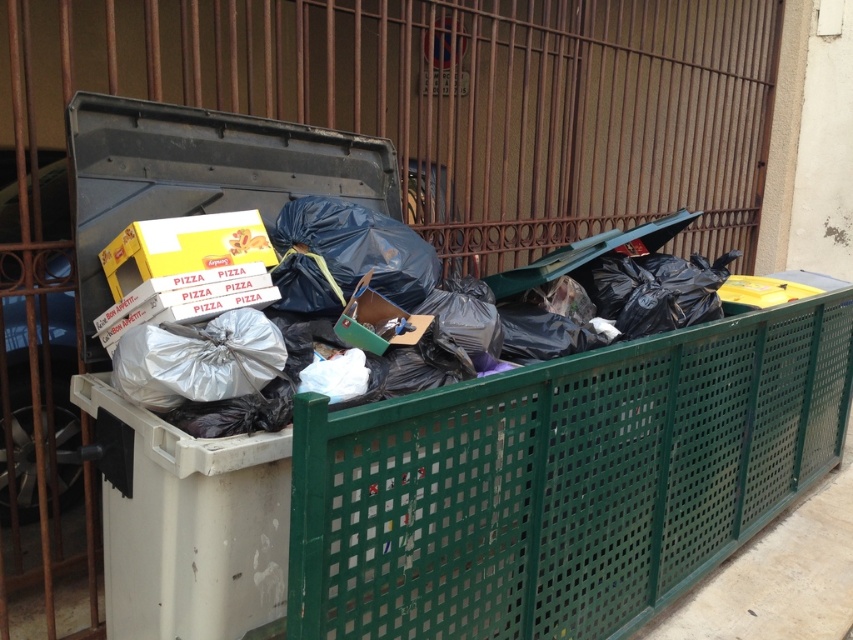
Does point (521, 323) come behind point (163, 237)?

Yes, point (521, 323) is behind point (163, 237).

Which is behind, point (183, 403) or point (171, 269)?

Point (171, 269)

Measure the distance between shiny metallic trash bin at center and camera.

shiny metallic trash bin at center is 1.84 meters from camera.

I want to click on shiny metallic trash bin at center, so click(x=569, y=316).